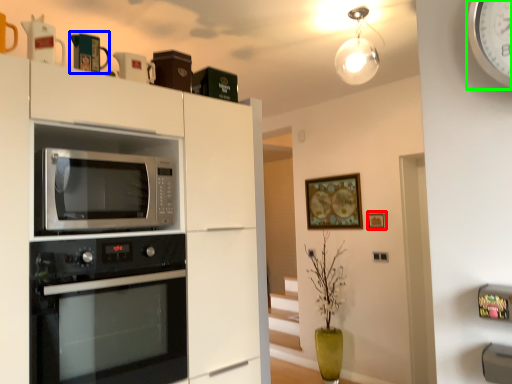
Question: Considering the real-world distances, which object is closest to picture frame (highlighted by a red box)? appliance (highlighted by a blue box) or clock (highlighted by a green box).

Choices:
 (A) appliance
 (B) clock

Answer: (A)